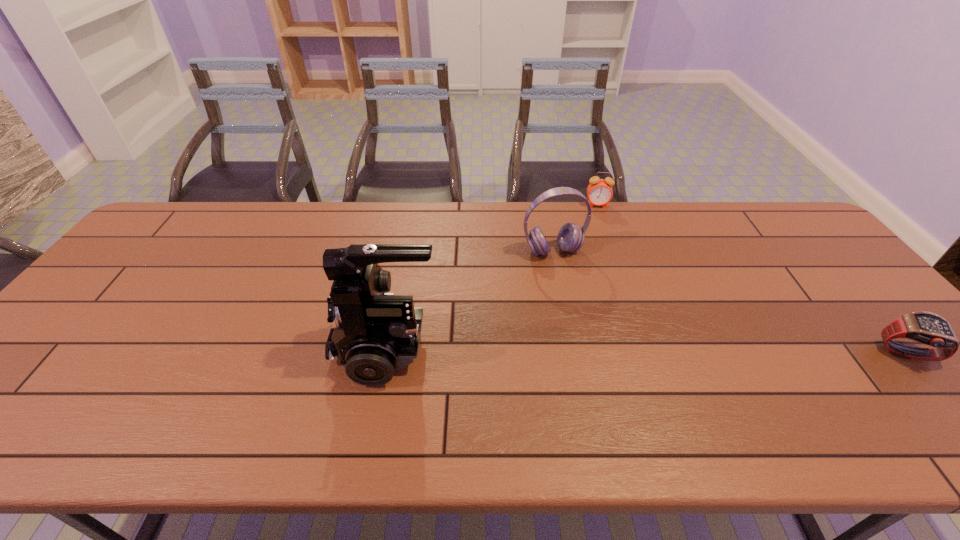
I want to click on free space between the alarm clock and the camcorder, so (x=492, y=276).

Identify the location of unoccupied area between the camcorder and the alarm clock. This screenshot has width=960, height=540. (492, 276).

Locate an element on the screen. vacant area between the second farthest object and the watch is located at coordinates (730, 302).

The height and width of the screenshot is (540, 960). In order to click on vacant region between the third tallest object and the shortest object in this screenshot , I will do `click(752, 280)`.

The image size is (960, 540). Find the location of `free space between the leftmost object and the second object from right to left`. free space between the leftmost object and the second object from right to left is located at coordinates (492, 276).

I want to click on vacant area that lies between the watch and the leftmost object, so click(x=647, y=350).

Locate which object ranks third in proximity to the second shortest object. Please provide its 2D coordinates. Your answer should be formatted as a tuple, i.e. [(x, y)], where the tuple contains the x and y coordinates of a point satisfying the conditions above.

[(928, 328)]

Identify which object is the nearest to the watch. Please provide its 2D coordinates. Your answer should be formatted as a tuple, i.e. [(x, y)], where the tuple contains the x and y coordinates of a point satisfying the conditions above.

[(570, 238)]

Find the location of a particular element. This screenshot has width=960, height=540. blank area in the image that satisfies the following two spatial constraints: 1. on the front side of the shortest object; 2. on the right side of the farthest object is located at coordinates (648, 354).